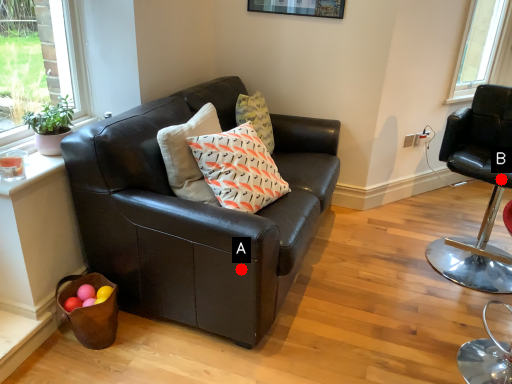
Question: Two points are circled on the image, labeled by A and B beside each circle. Which point is closer to the camera?

Choices:
 (A) A is closer
 (B) B is closer

Answer: (A)